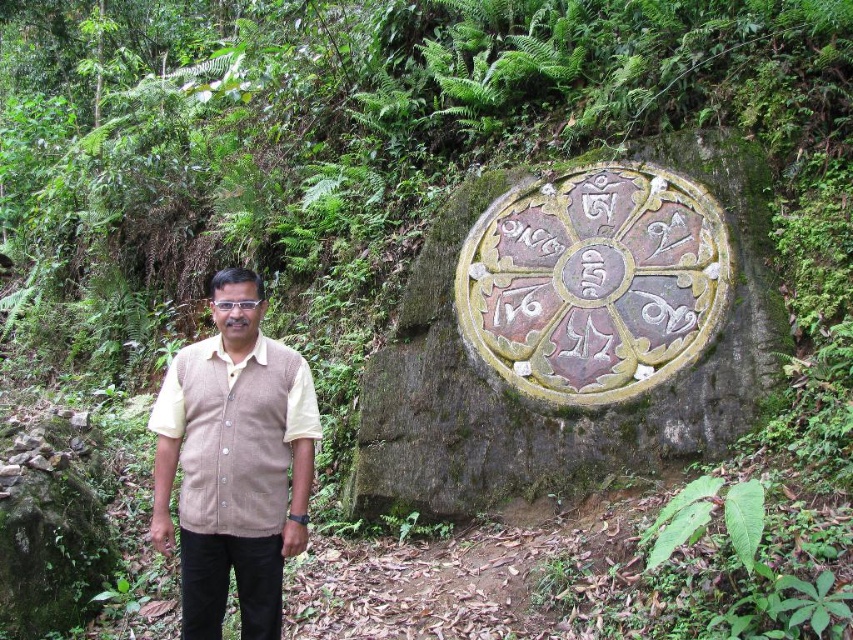
Between carved stone wheel at center and beige knitted vest at center, which one is positioned lower?

beige knitted vest at center

Which is above, carved stone wheel at center or beige knitted vest at center?

Positioned higher is carved stone wheel at center.

Between point (538, 396) and point (264, 372), which one is positioned in front?

Point (264, 372)

Locate an element on the screen. The height and width of the screenshot is (640, 853). carved stone wheel at center is located at coordinates (575, 330).